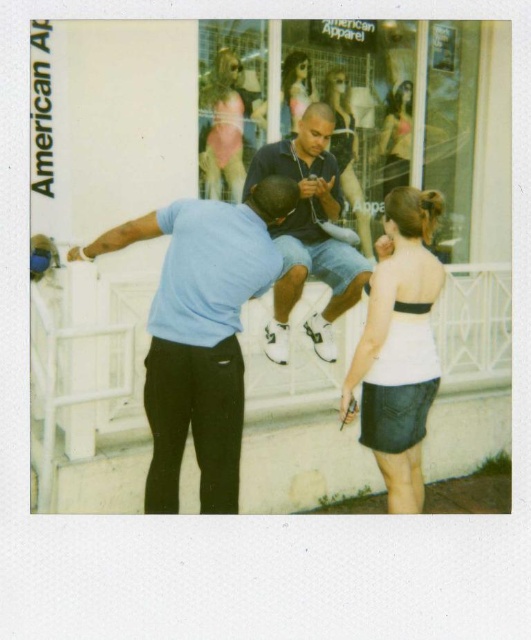
Question: Estimate the real-world distances between objects in this image. Which object is farther from the white matte storefront at center?

Choices:
 (A) light blue fabric shirt at left
 (B) transparent glass shop window at center
 (C) white strapless top at center
 (D) dark blue denim shorts at center

Answer: (B)

Question: Which point is farther to the camera?

Choices:
 (A) (423, 419)
 (B) (409, 156)

Answer: (B)

Question: Does white matte storefront at center appear over transparent glass shop window at center?

Choices:
 (A) yes
 (B) no

Answer: (B)

Question: Does transparent glass shop window at center have a larger size compared to white strapless top at center?

Choices:
 (A) yes
 (B) no

Answer: (A)

Question: Which object is farther from the camera taking this photo?

Choices:
 (A) matte black dress at center
 (B) light blue fabric shirt at left
 (C) matte black dress at upper center

Answer: (C)

Question: Can you confirm if white matte storefront at center is positioned below matte black dress at upper center?

Choices:
 (A) yes
 (B) no

Answer: (A)